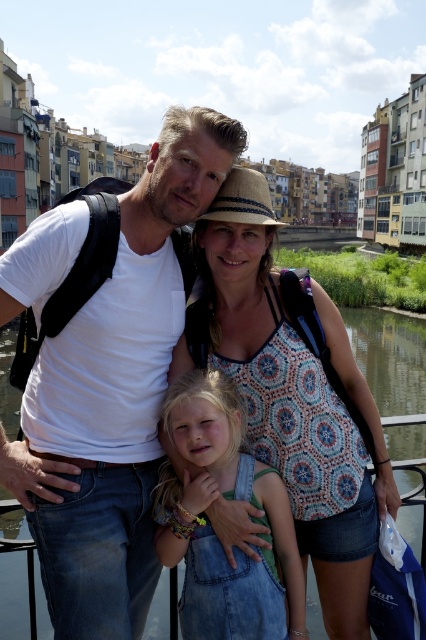
Is point (216, 576) positioned before point (311, 598)?

Yes.

Is denim overalls at center to the right of green water at center from the viewer's perspective?

Indeed, denim overalls at center is positioned on the right side of green water at center.

Locate an element on the screen. Image resolution: width=426 pixels, height=640 pixels. denim overalls at center is located at coordinates (212, 528).

Does white matte t-shirt at center have a smaller size compared to green water at center?

Yes.

Is point (54, 401) less distant than point (391, 388)?

That is True.

Find the location of a particular element. The image size is (426, 640). white matte t-shirt at center is located at coordinates (115, 392).

Between white matte t-shirt at center and denim overalls at center, which one appears on the right side from the viewer's perspective?

From the viewer's perspective, denim overalls at center appears more on the right side.

This screenshot has height=640, width=426. What do you see at coordinates (115, 392) in the screenshot?
I see `white matte t-shirt at center` at bounding box center [115, 392].

You are a GUI agent. You are given a task and a screenshot of the screen. Output one action in this format:
    pyautogui.click(x=<x>, y=<y>)
    Task: Click on the white matte t-shirt at center
    This screenshot has height=640, width=426.
    Given the screenshot: What is the action you would take?
    pyautogui.click(x=115, y=392)